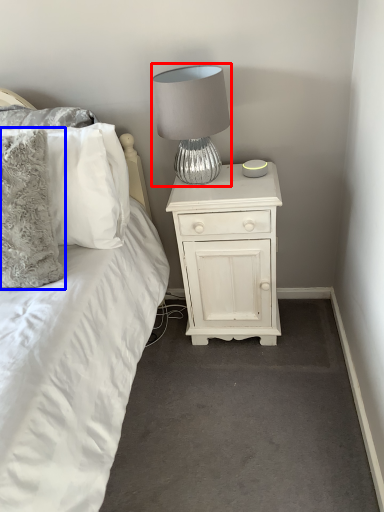
Question: Which point is closer to the camera, lamp (highlighted by a red box) or pillow (highlighted by a blue box)?

Choices:
 (A) lamp
 (B) pillow

Answer: (B)